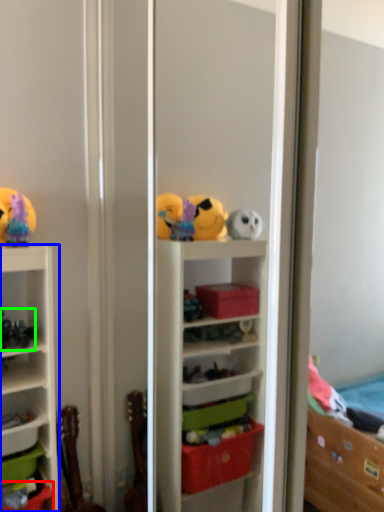
Question: Which is nearer to the storage box (highlighted by a red box)? shelf (highlighted by a blue box) or toy (highlighted by a green box).

Choices:
 (A) shelf
 (B) toy

Answer: (A)